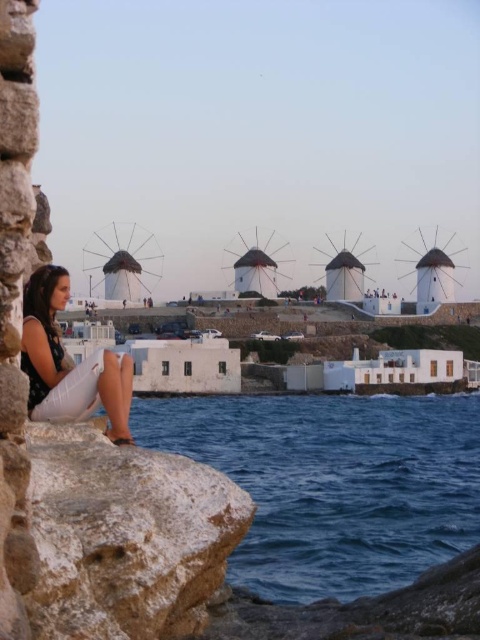
You are a photographer planning to capture the blue water at lower left and the white rough rock at lower left in a single frame. Based on the scene, which object occupies a wider area in the image?

The blue water at lower left occupies a wider area in the image as its width is larger than that of the white rough rock at lower left.

You are a photographer wanting to capture the white rough rock at lower left and the matte black dress at lower left in the same frame. Which object is to the right of the other?

The white rough rock at lower left is positioned on the right side of the matte black dress at lower left.

You are standing at the center of the scene and want to walk towards the blue water at lower left and the white rough rock at lower left. Which object will you encounter first?

The blue water at lower left is not as tall as the white rough rock at lower left, so you will encounter the white rough rock at lower left first because it is closer to you.